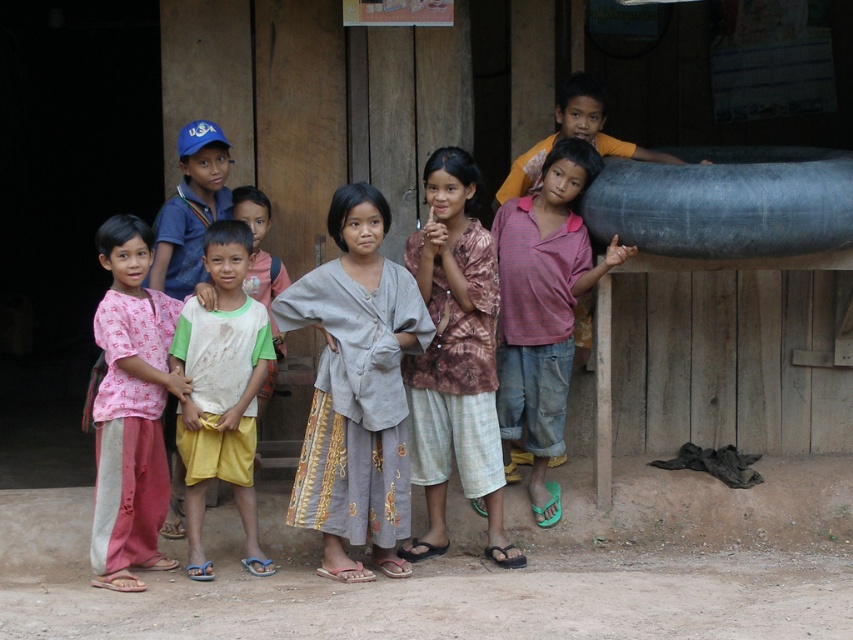
Question: Which object is positioned farthest from the white t-shirt at center?

Choices:
 (A) white cotton shirt at center
 (B) pink striped shirt at center
 (C) smooth gray pipe at upper right

Answer: (C)

Question: Does smooth gray pipe at upper right have a smaller size compared to white cotton shirt at center?

Choices:
 (A) no
 (B) yes

Answer: (A)

Question: Does gray fabric shirt at center appear under pink striped shirt at center?

Choices:
 (A) yes
 (B) no

Answer: (A)

Question: Does gray fabric shirt at center appear on the left side of printed fabric shirt at center?

Choices:
 (A) yes
 (B) no

Answer: (A)

Question: Estimate the real-world distances between objects in this image. Which object is farther from the printed cotton shirt at left?

Choices:
 (A) smooth gray pipe at upper right
 (B) white t-shirt at center
 (C) white cotton shirt at center

Answer: (A)

Question: Which object appears closest to the camera in this image?

Choices:
 (A) printed fabric shirt at center
 (B) white t-shirt at center
 (C) pink striped shirt at center
 (D) smooth gray pipe at upper right

Answer: (B)